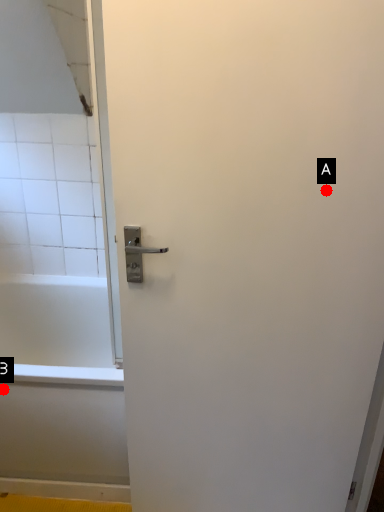
Question: Two points are circled on the image, labeled by A and B beside each circle. Which of the following is the closest to the observer?

Choices:
 (A) A is closer
 (B) B is closer

Answer: (A)